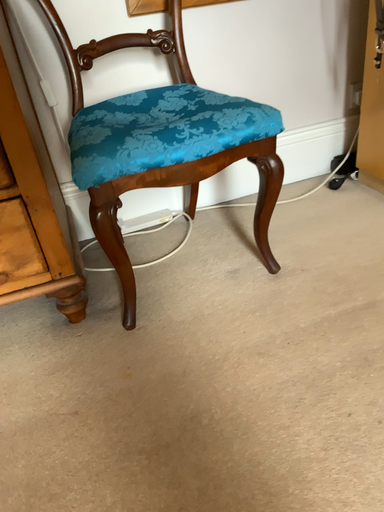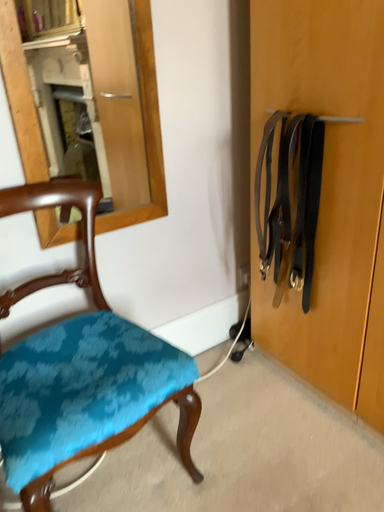
Question: How did the camera likely rotate when shooting the video?

Choices:
 (A) rotated upward
 (B) rotated downward

Answer: (A)